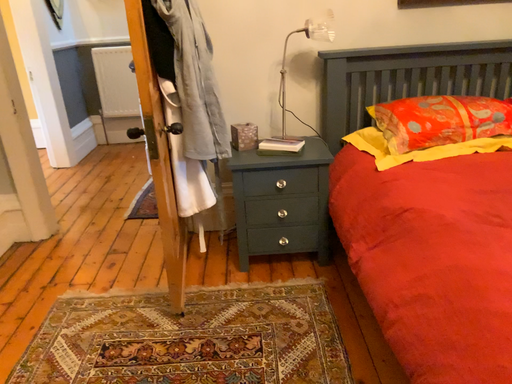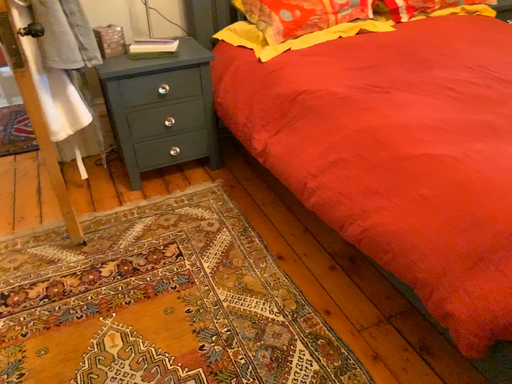
Question: Which way did the camera rotate in the video?

Choices:
 (A) rotated right
 (B) rotated left

Answer: (A)